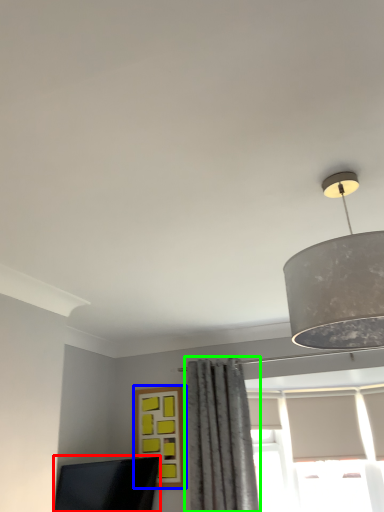
Question: Estimate the real-world distances between objects in this image. Which object is closer to computer monitor (highlighted by a red box), window (highlighted by a blue box) or curtain (highlighted by a green box)?

Choices:
 (A) window
 (B) curtain

Answer: (A)